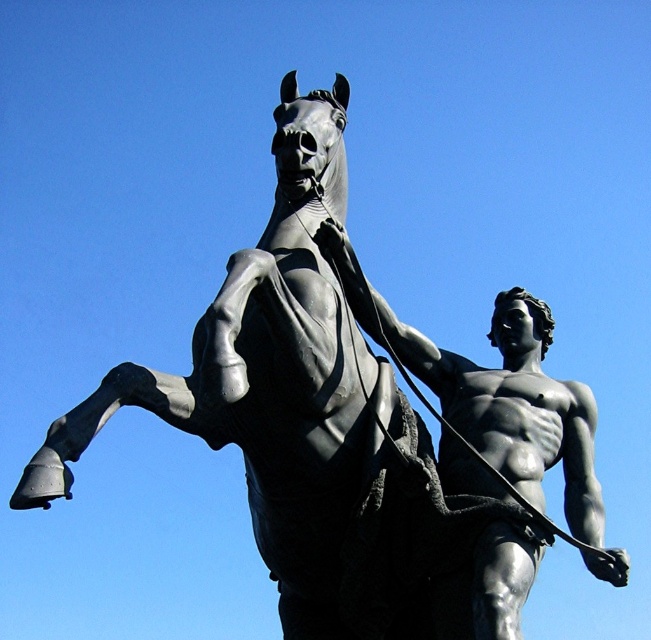
Question: Among these objects, which one is farthest from the camera?

Choices:
 (A) polished bronze horse at center
 (B) polished bronze statue at center

Answer: (B)

Question: Is polished bronze horse at center wider than polished bronze statue at center?

Choices:
 (A) no
 (B) yes

Answer: (A)

Question: Does polished bronze horse at center have a larger size compared to polished bronze statue at center?

Choices:
 (A) no
 (B) yes

Answer: (A)

Question: Among these objects, which one is nearest to the camera?

Choices:
 (A) polished bronze horse at center
 (B) polished bronze statue at center

Answer: (A)

Question: Can you confirm if polished bronze horse at center is positioned above polished bronze statue at center?

Choices:
 (A) yes
 (B) no

Answer: (A)